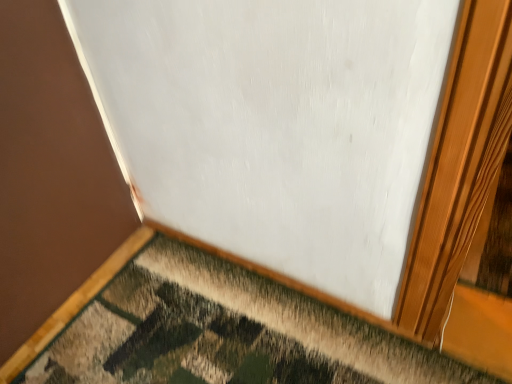
What do you see at coordinates (213, 330) in the screenshot? I see `textured green mat at lower left` at bounding box center [213, 330].

The image size is (512, 384). What are the coordinates of `textured green mat at lower left` in the screenshot? It's located at (213, 330).

Locate an element on the screen. The height and width of the screenshot is (384, 512). textured green mat at lower left is located at coordinates (213, 330).